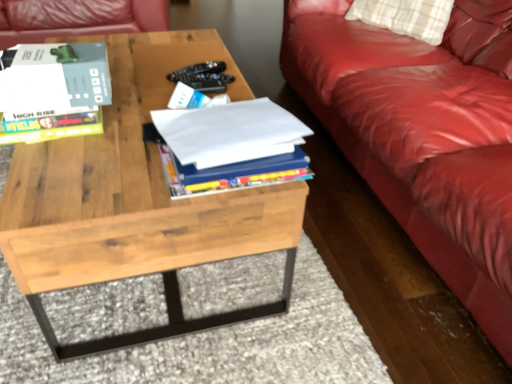
Question: From a real-world perspective, is white paper at center, marked as the 1th book in a right-to-left arrangement, above or below natural wood coffee table at center?

Choices:
 (A) below
 (B) above

Answer: (B)

Question: In the image, is white paper at center, marked as the 1th book in a right-to-left arrangement, positioned in front of or behind natural wood coffee table at center?

Choices:
 (A) front
 (B) behind

Answer: (B)

Question: Which object is positioned farthest from the natural wood coffee table at center?

Choices:
 (A) white paper at center, marked as the 2th book in a left-to-right arrangement
 (B) matte gray book at upper left, which appears as the 2th book when viewed from the right

Answer: (B)

Question: Which of these objects is positioned farthest from the white paper at center, marked as the 1th book in a right-to-left arrangement?

Choices:
 (A) matte gray book at upper left, arranged as the first book when viewed from the left
 (B) natural wood coffee table at center

Answer: (A)